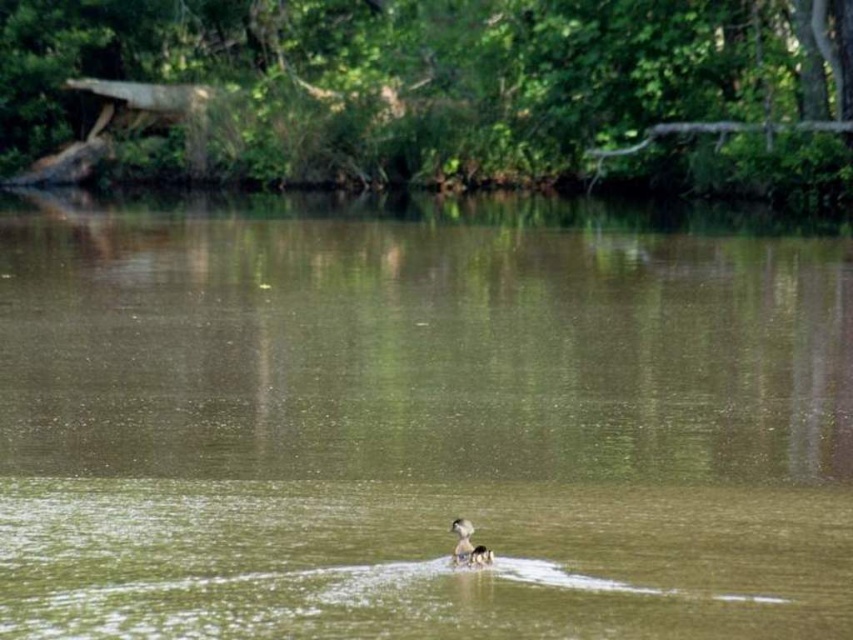
Question: Among these objects, which one is farthest from the camera?

Choices:
 (A) greenish murky water at center
 (B) brown fuzzy duck at center
 (C) white matte duck at center

Answer: (B)

Question: Which object is closer to the camera taking this photo?

Choices:
 (A) brown fuzzy duck at center
 (B) white matte duck at center
 (C) greenish murky water at center

Answer: (C)

Question: From the image, what is the correct spatial relationship of greenish murky water at center in relation to brown fuzzy duck at center?

Choices:
 (A) below
 (B) above

Answer: (B)

Question: Is greenish murky water at center to the right of white matte duck at center from the viewer's perspective?

Choices:
 (A) yes
 (B) no

Answer: (B)

Question: Is white matte duck at center to the left of brown fuzzy duck at center from the viewer's perspective?

Choices:
 (A) yes
 (B) no

Answer: (B)

Question: Among these points, which one is nearest to the camera?

Choices:
 (A) (460, 531)
 (B) (462, 560)
 (C) (398, 480)

Answer: (A)